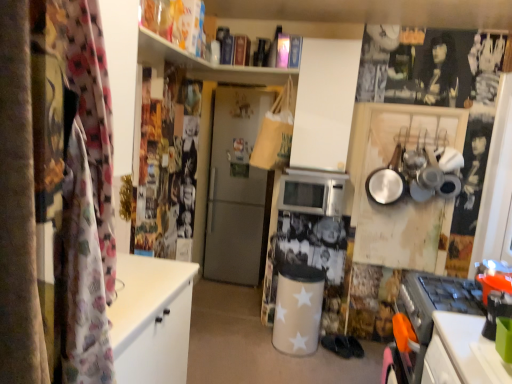
Question: Is satin silver refrigerator at center not within silver metallic microwave at center?

Choices:
 (A) no
 (B) yes

Answer: (B)

Question: Is silver metallic microwave at center completely or partially inside satin silver refrigerator at center?

Choices:
 (A) no
 (B) yes

Answer: (A)

Question: Can you confirm if satin silver refrigerator at center is shorter than silver metallic microwave at center?

Choices:
 (A) yes
 (B) no

Answer: (B)

Question: Does satin silver refrigerator at center have a greater width compared to silver metallic microwave at center?

Choices:
 (A) no
 (B) yes

Answer: (B)

Question: Is satin silver refrigerator at center positioned with its back to silver metallic microwave at center?

Choices:
 (A) yes
 (B) no

Answer: (B)

Question: From a real-world perspective, is silver metallic microwave at center positioned above or below black fabric shoe at center?

Choices:
 (A) above
 (B) below

Answer: (A)

Question: Looking at their shapes, would you say silver metallic microwave at center is wider or thinner than black fabric shoe at center?

Choices:
 (A) thin
 (B) wide

Answer: (B)

Question: Considering the positions of point click(x=324, y=177) and point click(x=349, y=354), is point click(x=324, y=177) closer or farther from the camera than point click(x=349, y=354)?

Choices:
 (A) farther
 (B) closer

Answer: (B)

Question: Is silver metallic microwave at center taller or shorter than black fabric shoe at center?

Choices:
 (A) short
 (B) tall

Answer: (B)

Question: Would you say satin silver refrigerator at center is to the left or to the right of silver metallic microwave at center in the picture?

Choices:
 (A) left
 (B) right

Answer: (A)

Question: Is satin silver refrigerator at center wider or thinner than silver metallic microwave at center?

Choices:
 (A) thin
 (B) wide

Answer: (B)

Question: Considering the positions of satin silver refrigerator at center and silver metallic microwave at center in the image, is satin silver refrigerator at center bigger or smaller than silver metallic microwave at center?

Choices:
 (A) small
 (B) big

Answer: (B)

Question: Considering the positions of satin silver refrigerator at center and silver metallic microwave at center in the image, is satin silver refrigerator at center taller or shorter than silver metallic microwave at center?

Choices:
 (A) tall
 (B) short

Answer: (A)

Question: Looking at their shapes, would you say black fabric shoe at center is wider or thinner than satin silver refrigerator at center?

Choices:
 (A) wide
 (B) thin

Answer: (B)

Question: From a real-world perspective, is black fabric shoe at center physically located above or below satin silver refrigerator at center?

Choices:
 (A) below
 (B) above

Answer: (A)